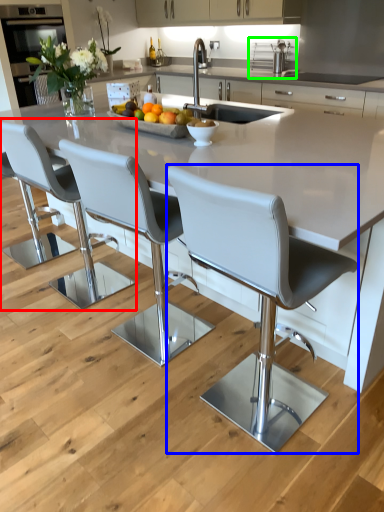
Question: Based on their relative distances, which object is nearer to chair (highlighted by a red box)? Choose from chair (highlighted by a blue box) and stainless steel (highlighted by a green box).

Choices:
 (A) chair
 (B) stainless steel

Answer: (A)